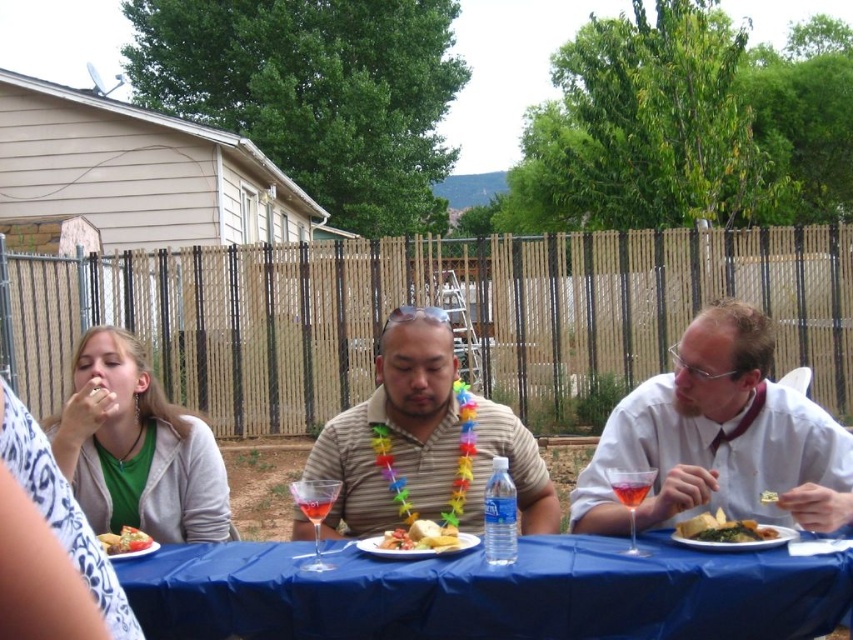
Question: Which object is closer to the camera taking this photo?

Choices:
 (A) white shirt at center
 (B) striped cotton shirt at center

Answer: (A)

Question: Is striped cotton shirt at center thinner than yellow crumbly cake at center?

Choices:
 (A) no
 (B) yes

Answer: (A)

Question: Considering the real-world distances, which object is closest to the yellow crumbly cake at center?

Choices:
 (A) green leafy vegetables at center
 (B) matte green shirt at left
 (C) clear plastic water bottle at center

Answer: (A)

Question: Which object appears farthest from the camera in this image?

Choices:
 (A) pink glass at table center
 (B) matte green shirt at left
 (C) green leafy vegetables at center
 (D) striped cotton shirt at center

Answer: (D)

Question: Can you confirm if golden crispy bread at center is positioned to the left of tomato salad at left?

Choices:
 (A) no
 (B) yes

Answer: (A)

Question: In this image, where is white shirt at center located relative to green leafy vegetables at center?

Choices:
 (A) right
 (B) left

Answer: (B)